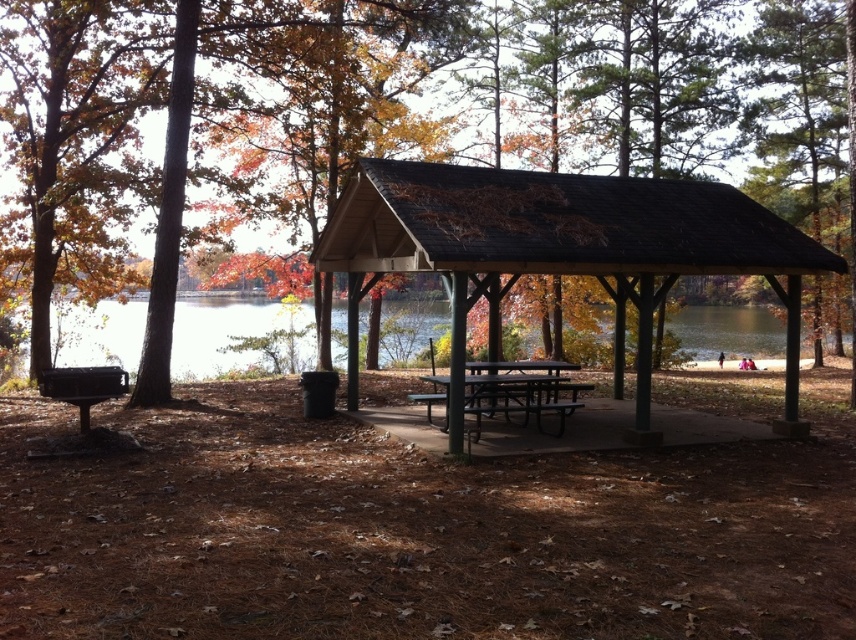
You are standing at the entrance of the park and want to locate the black metal picnic table at center. According to the coordinates provided, where should you head to find it?

The black metal picnic table at center is located at point coordinates (520,390).

You are standing at the picnic shelter and want to find the brown wood tree at center. Which direction should you look to see the point at coordinates (473, 220)?

The point at coordinates (473, 220) is located on the brown wood tree at center, so you should look towards the center of the scene to see it.